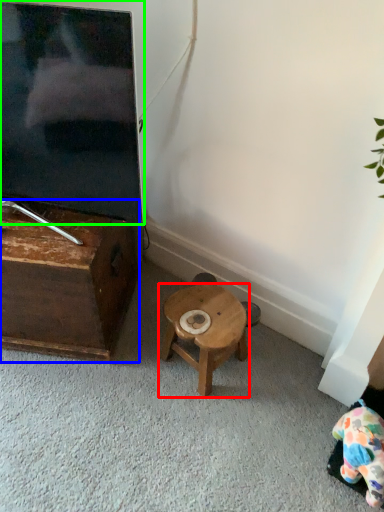
Question: Based on their relative distances, which object is farther from stool (highlighted by a red box)? Choose from table (highlighted by a blue box) and television (highlighted by a green box).

Choices:
 (A) table
 (B) television

Answer: (B)